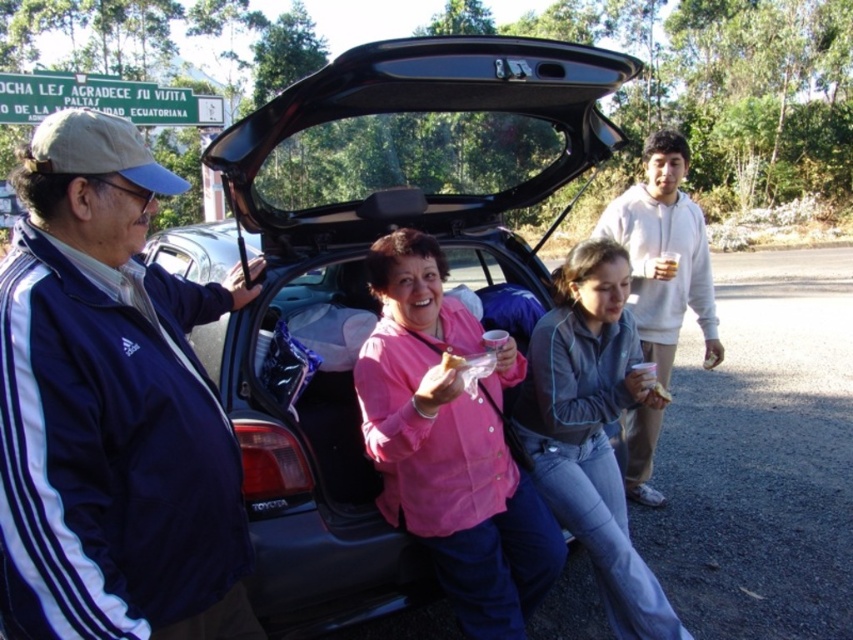
Question: Is pink fabric at center below smooth plastic sandwich at lower center?

Choices:
 (A) no
 (B) yes

Answer: (B)

Question: Can you confirm if pink fabric at center is positioned to the left of denim jeans at center?

Choices:
 (A) yes
 (B) no

Answer: (A)

Question: Which object is the farthest from the golden crispy pastry at lower center?

Choices:
 (A) denim jeans at center
 (B) blue fabric jacket at left
 (C) light gray hoodie at center
 (D) black matte car trunk at center

Answer: (B)

Question: From the image, what is the correct spatial relationship of light gray hoodie at center in relation to smooth plastic sandwich at lower center?

Choices:
 (A) right
 (B) left

Answer: (B)

Question: Which point is closer to the camera taking this photo?

Choices:
 (A) [598, 346]
 (B) [656, 394]
 (C) [186, 586]

Answer: (C)

Question: Which point is closer to the camera?

Choices:
 (A) (608, 548)
 (B) (654, 252)
 (C) (521, 476)

Answer: (A)